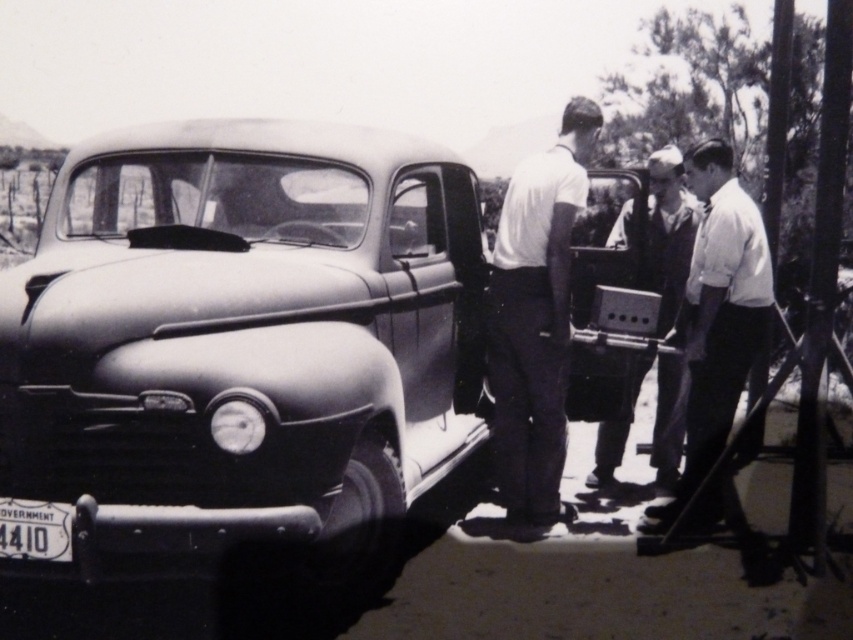
Question: Is smooth white shirt at center positioned in front of white matte license plate at lower left?

Choices:
 (A) no
 (B) yes

Answer: (A)

Question: Which point is closer to the camera taking this photo?

Choices:
 (A) (714, 493)
 (B) (682, 266)
 (C) (18, 534)

Answer: (C)

Question: Which object appears farthest from the camera in this image?

Choices:
 (A) smooth fabric shirt at center
 (B) white matte license plate at lower left

Answer: (A)

Question: Can you confirm if matte black car at center is wider than white matte license plate at lower left?

Choices:
 (A) yes
 (B) no

Answer: (A)

Question: Does smooth white shirt at center have a smaller size compared to white matte license plate at lower left?

Choices:
 (A) yes
 (B) no

Answer: (B)

Question: Which object appears farthest from the camera in this image?

Choices:
 (A) matte black car at center
 (B) smooth white shirt at center
 (C) white smooth shirt at center
 (D) smooth fabric shirt at center

Answer: (D)